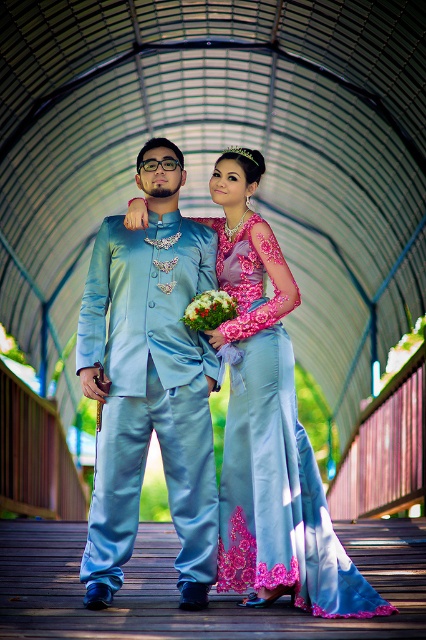
Question: Observing the image, what is the correct spatial positioning of silky pink dress at center in reference to green floral bouquet at center?

Choices:
 (A) above
 (B) below

Answer: (B)

Question: Which of the following is the farthest from the observer?

Choices:
 (A) (161, 324)
 (B) (172, 436)

Answer: (A)

Question: Does satin blue suit at center appear on the right side of silky pink dress at center?

Choices:
 (A) no
 (B) yes

Answer: (A)

Question: Which point is closer to the camera?

Choices:
 (A) satin blue suit at center
 (B) silky pink dress at center
 (C) green floral bouquet at center
 (D) satin light blue suit at center

Answer: (B)

Question: Among these objects, which one is nearest to the camera?

Choices:
 (A) satin light blue suit at center
 (B) green floral bouquet at center

Answer: (A)

Question: Does satin blue suit at center have a smaller size compared to satin light blue suit at center?

Choices:
 (A) yes
 (B) no

Answer: (B)